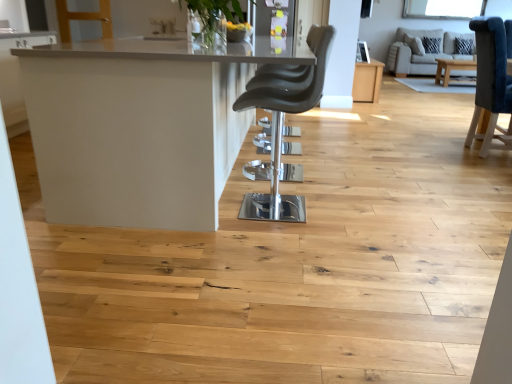
Question: From a real-world perspective, is white glossy table at center, the 1th table in the bottom-to-top sequence, over clear glass window screen at upper center?

Choices:
 (A) yes
 (B) no

Answer: (B)

Question: Can you confirm if white glossy table at center, the 2th table viewed from the top, is positioned to the right of clear glass window screen at upper center?

Choices:
 (A) yes
 (B) no

Answer: (B)

Question: Does white glossy table at center, positioned as the 1th table in front-to-back order, turn towards clear glass window screen at upper center?

Choices:
 (A) yes
 (B) no

Answer: (B)

Question: Is white glossy table at center, the 2th table viewed from the top, next to clear glass window screen at upper center and touching it?

Choices:
 (A) yes
 (B) no

Answer: (B)

Question: Considering the relative sizes of white glossy table at center, which ranks as the 1th table in left-to-right order, and clear glass window screen at upper center in the image provided, is white glossy table at center, which ranks as the 1th table in left-to-right order, wider than clear glass window screen at upper center?

Choices:
 (A) no
 (B) yes

Answer: (B)

Question: From the image's perspective, is white glossy table at center, which is the second table from back to front, under clear glass window screen at upper center?

Choices:
 (A) yes
 (B) no

Answer: (A)

Question: Is light brown wood table at center, the first table in the back-to-front sequence, with matte black chair at center?

Choices:
 (A) yes
 (B) no

Answer: (B)

Question: From the image's perspective, does light brown wood table at center, positioned as the second table in bottom-to-top order, appear lower than matte black chair at center?

Choices:
 (A) no
 (B) yes

Answer: (A)

Question: Is light brown wood table at center, which ranks as the 1th table in top-to-bottom order, in front of matte black chair at center?

Choices:
 (A) no
 (B) yes

Answer: (A)

Question: Considering the relative sizes of light brown wood table at center, positioned as the second table in bottom-to-top order, and matte black chair at center in the image provided, is light brown wood table at center, positioned as the second table in bottom-to-top order, smaller than matte black chair at center?

Choices:
 (A) yes
 (B) no

Answer: (B)

Question: Considering the relative positions of light brown wood table at center, positioned as the second table in bottom-to-top order, and matte black chair at center in the image provided, is light brown wood table at center, positioned as the second table in bottom-to-top order, behind matte black chair at center?

Choices:
 (A) no
 (B) yes

Answer: (B)

Question: From a real-world perspective, is white glossy table at center, which ranks as the 1th table in left-to-right order, located higher than matte black chair at center?

Choices:
 (A) no
 (B) yes

Answer: (A)